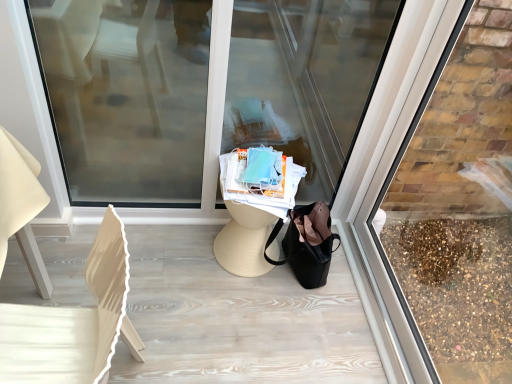
Question: In the image, is transparent glass shop window at center, the second shop window positioned from the right, positioned in front of or behind white wood chair at left?

Choices:
 (A) front
 (B) behind

Answer: (B)

Question: Choose the correct answer: Is transparent glass shop window at center, marked as the 1th shop window in a left-to-right arrangement, inside white wood chair at left or outside it?

Choices:
 (A) inside
 (B) outside

Answer: (B)

Question: Which is nearer to the transparent glass at right, the first shop window in the right-to-left sequence?

Choices:
 (A) transparent glass shop window at center, the second shop window positioned from the right
 (B) white wood chair at left

Answer: (A)

Question: Based on their relative distances, which object is nearer to the white wood chair at left?

Choices:
 (A) transparent glass at right, the first shop window in the right-to-left sequence
 (B) transparent glass shop window at center, the second shop window positioned from the right

Answer: (B)